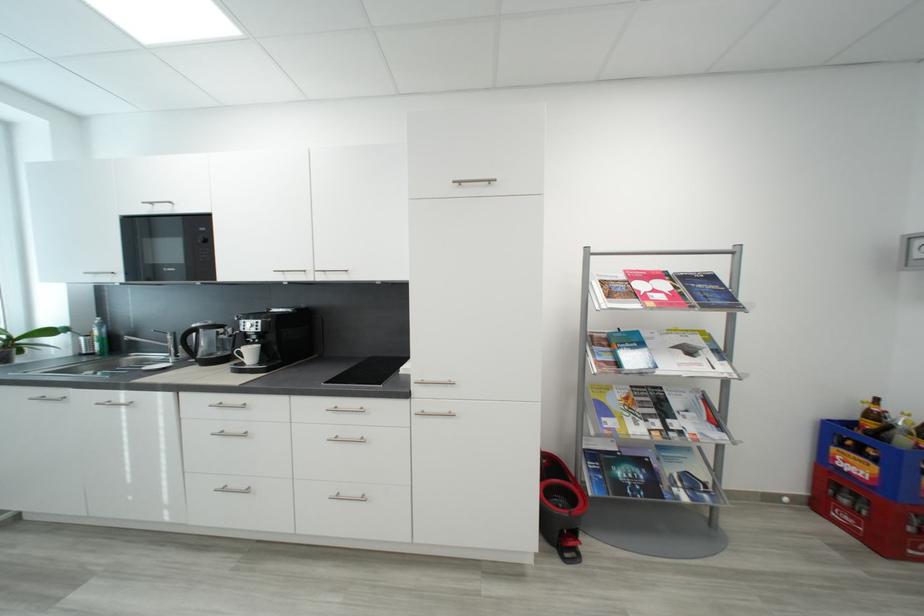
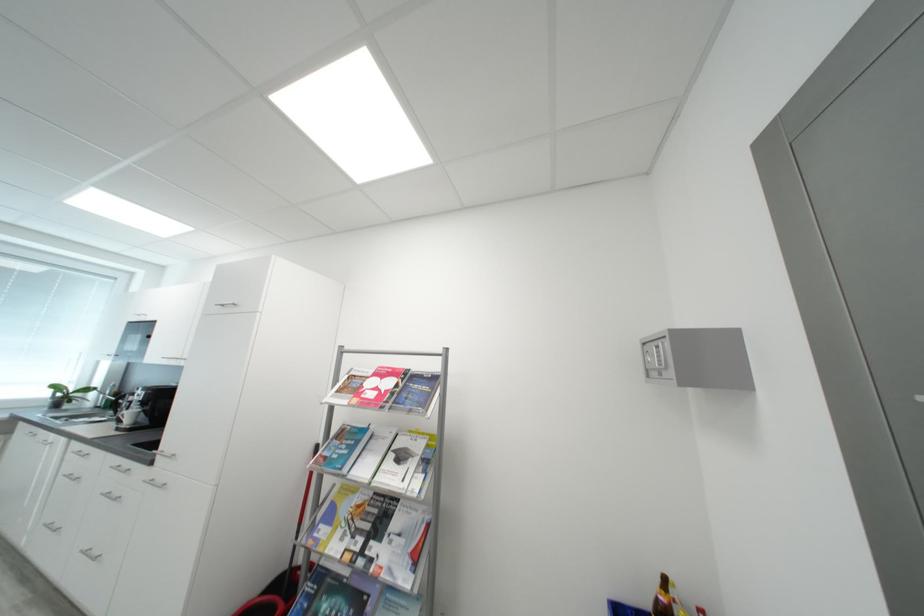
Where in the second image is the point corresponding to [681,426] from the first image?

(380, 549)